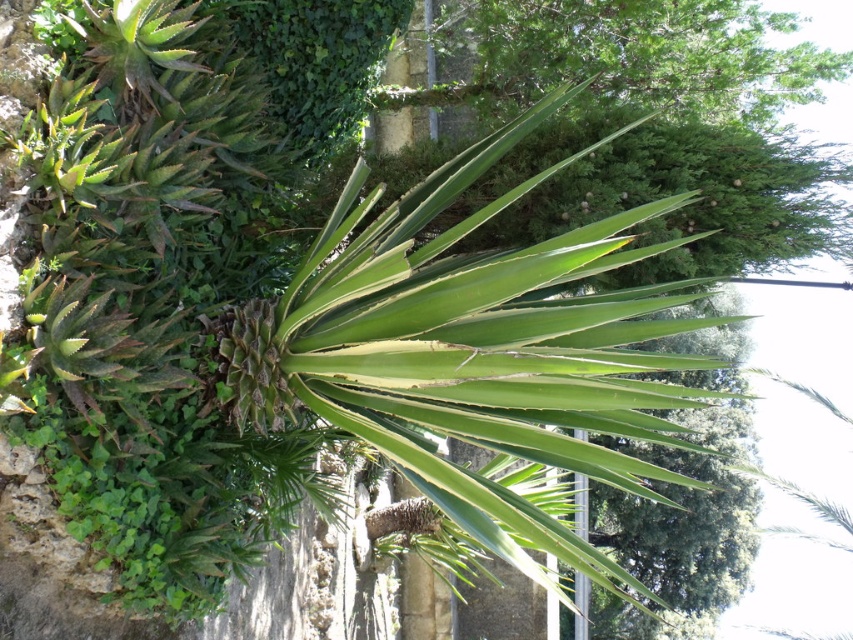
Describe the element at coordinates (474, 352) in the screenshot. I see `green leafy palm tree at center` at that location.

The image size is (853, 640). I want to click on green leafy palm tree at center, so click(x=474, y=352).